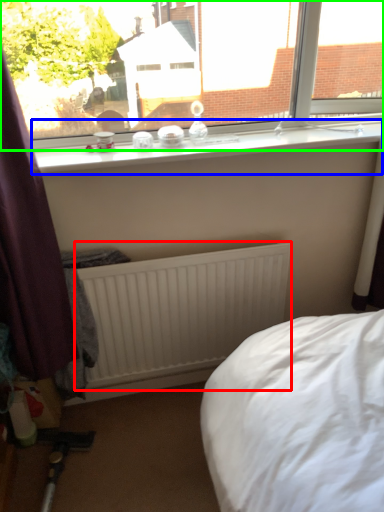
Question: Which is farther away from radiator (highlighted by a red box)? window sill (highlighted by a blue box) or window (highlighted by a green box)?

Choices:
 (A) window sill
 (B) window

Answer: (B)